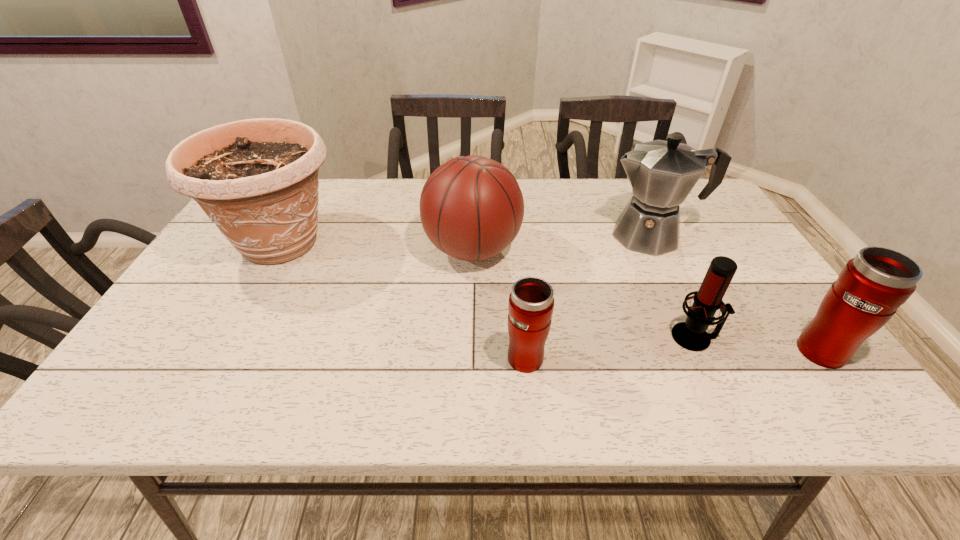
I want to click on free space at the left edge of the desktop, so click(x=209, y=296).

Image resolution: width=960 pixels, height=540 pixels. What are the coordinates of `free space at the right edge of the desktop` in the screenshot? It's located at (740, 261).

Locate an element on the screen. vacant space at the near right corner of the desktop is located at coordinates (811, 363).

What are the coordinates of `unoccupied area between the taller thermos bottle and the shorter thermos bottle` in the screenshot? It's located at (674, 353).

The width and height of the screenshot is (960, 540). I want to click on vacant point located between the left thermos bottle and the right thermos bottle, so click(x=674, y=353).

In order to click on free spot between the right thermos bottle and the shorter thermos bottle in this screenshot , I will do `click(674, 353)`.

Identify the location of free spot between the left thermos bottle and the leftmost object. (404, 299).

This screenshot has height=540, width=960. I want to click on free spot between the taller thermos bottle and the basketball, so click(x=647, y=299).

I want to click on blank region between the basketball and the rightmost object, so click(x=647, y=299).

Identify the location of free space between the shorter thermos bottle and the microphone. (611, 347).